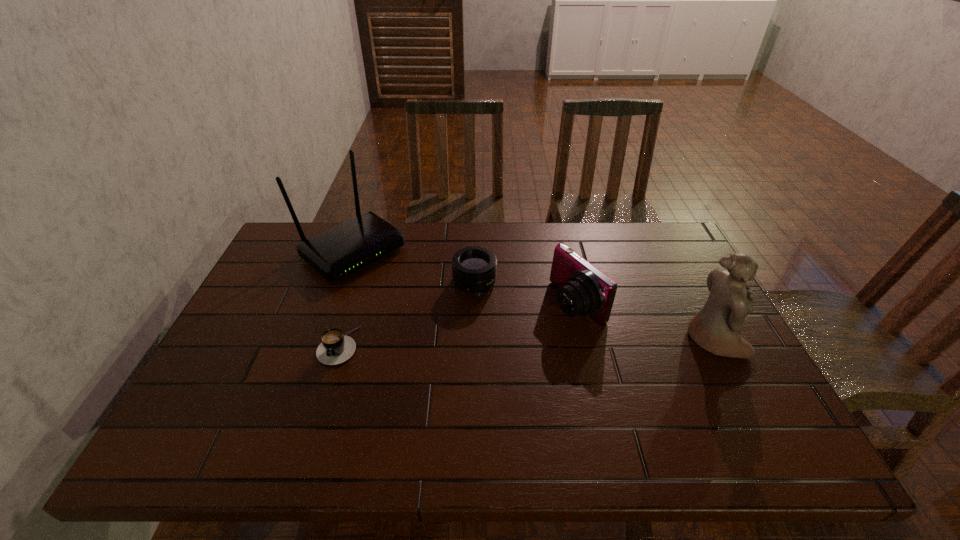
Where is `vacant space at the far edge of the desktop`? vacant space at the far edge of the desktop is located at coordinates (497, 224).

Where is `vacant space at the near edge`? vacant space at the near edge is located at coordinates (550, 402).

Where is `free spot at the left edge of the desktop`? free spot at the left edge of the desktop is located at coordinates (286, 281).

Identify the location of free point at the right edge. This screenshot has width=960, height=540. (694, 357).

Locate an element on the screen. The height and width of the screenshot is (540, 960). vacant space at the far left corner of the desktop is located at coordinates (290, 249).

Find the location of a particular element. free space at the near left corner of the desktop is located at coordinates (236, 396).

Where is `vacant region at the far right corner of the desktop`? Image resolution: width=960 pixels, height=540 pixels. vacant region at the far right corner of the desktop is located at coordinates (636, 227).

The image size is (960, 540). Identify the location of free space that is in between the figurine and the shortest object. (526, 342).

In order to click on free space between the second object from right to left and the shortest object in this screenshot , I will do `click(458, 325)`.

The height and width of the screenshot is (540, 960). Find the location of `empty space that is in between the third shortest object and the third object from right to left`. empty space that is in between the third shortest object and the third object from right to left is located at coordinates (526, 293).